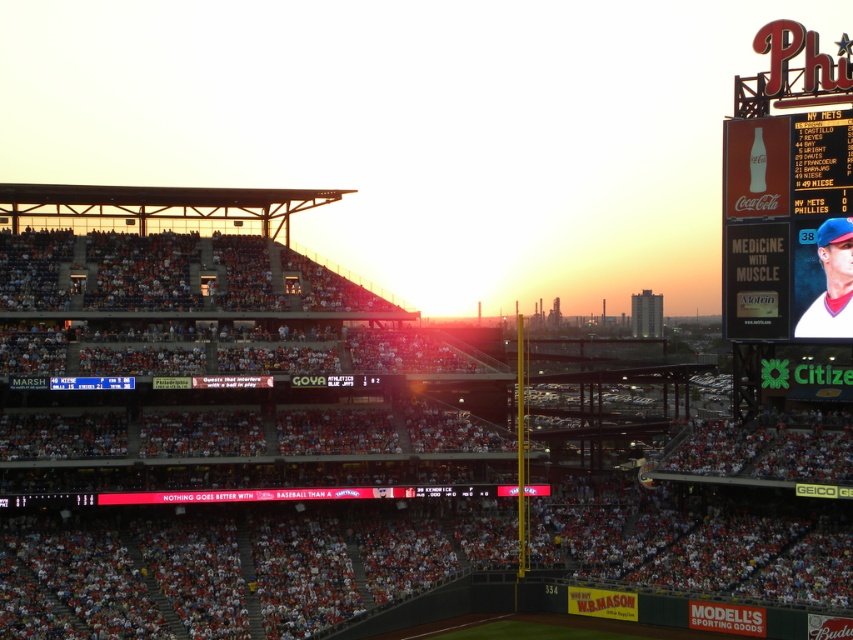
Who is taller, white jersey baseball player at upper right or red plastic scoreboard at upper right?

red plastic scoreboard at upper right

Does point (456, 412) come in front of point (766, 32)?

No, (456, 412) is behind (766, 32).

Between point (44, 632) and point (828, 61), which one is positioned behind?

The point (828, 61) is behind.

Find the location of a particular element. This screenshot has height=640, width=853. white jersey baseball player at upper right is located at coordinates (241, 480).